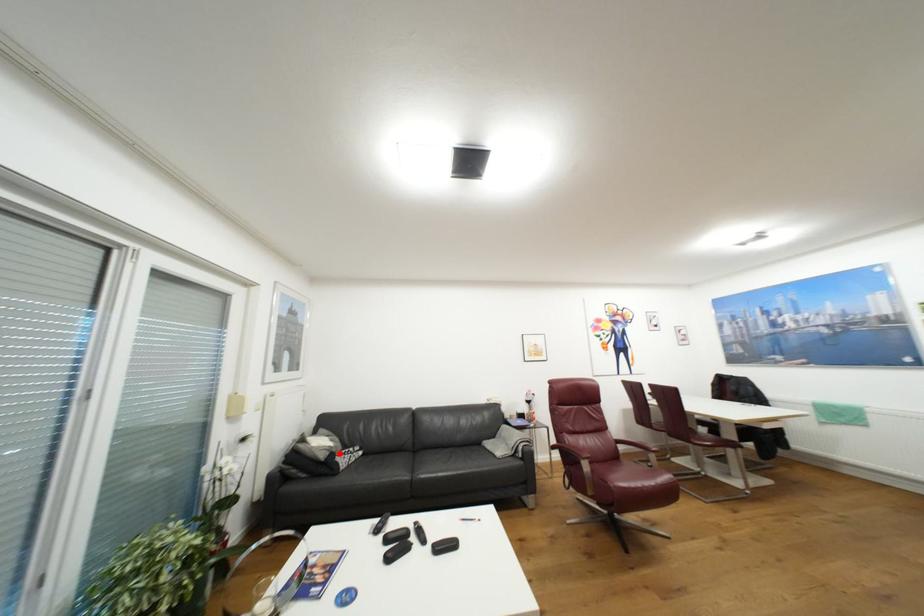
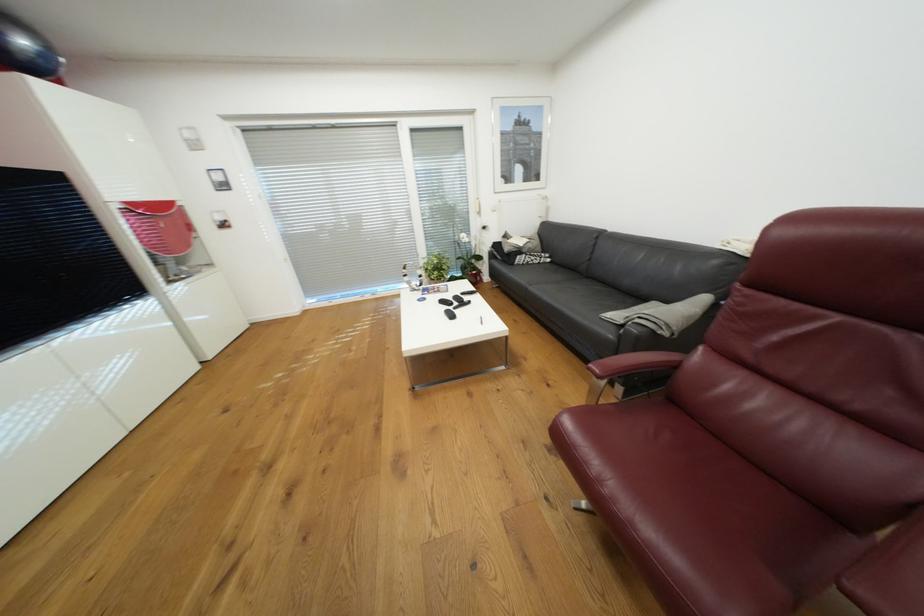
Find the pixel in the second image that matches the highlighted location in the first image.

(526, 252)